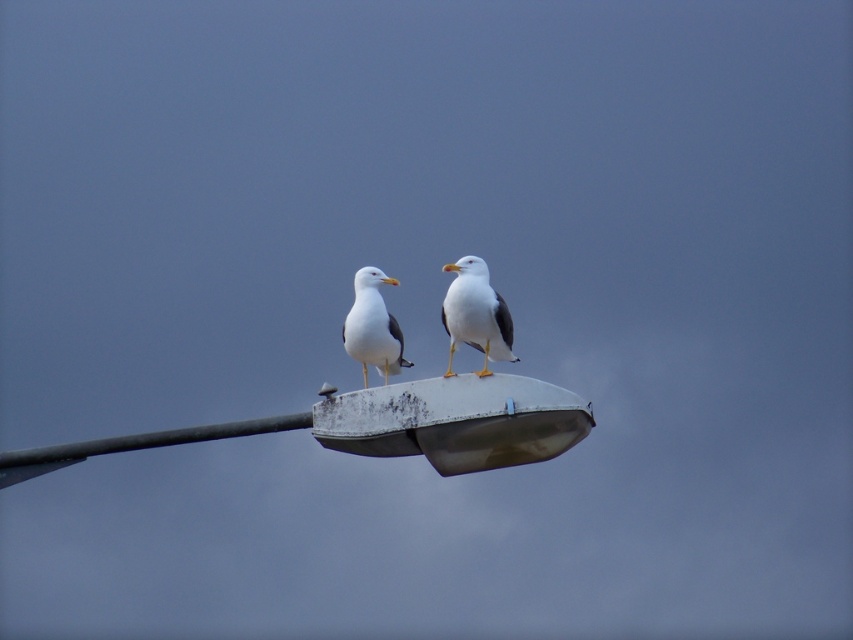
Does white matte seagull at upper center have a smaller size compared to white matte seagull at center?

Yes.

Identify the location of white matte seagull at upper center. This screenshot has height=640, width=853. (474, 314).